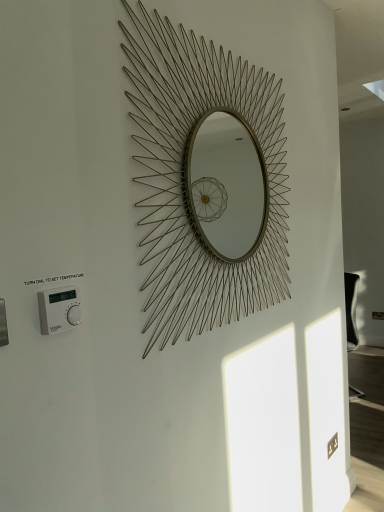
Question: Is white plastic thermostat at lower left smaller than gold wire mirror at center?

Choices:
 (A) no
 (B) yes

Answer: (B)

Question: Is white plastic thermostat at lower left placed right next to gold wire mirror at center?

Choices:
 (A) yes
 (B) no

Answer: (B)

Question: From the image's perspective, is white plastic thermostat at lower left on top of gold wire mirror at center?

Choices:
 (A) no
 (B) yes

Answer: (A)

Question: Is white plastic thermostat at lower left located outside gold wire mirror at center?

Choices:
 (A) no
 (B) yes

Answer: (B)

Question: Can you confirm if white plastic thermostat at lower left is bigger than gold wire mirror at center?

Choices:
 (A) no
 (B) yes

Answer: (A)

Question: Can you confirm if white plastic thermostat at lower left is positioned to the right of gold wire mirror at center?

Choices:
 (A) no
 (B) yes

Answer: (A)

Question: Would you say gold wire mirror at center is outside white plastic thermostat at lower left?

Choices:
 (A) no
 (B) yes

Answer: (B)

Question: Is gold wire mirror at center to the right of white plastic thermostat at lower left from the viewer's perspective?

Choices:
 (A) yes
 (B) no

Answer: (A)

Question: Does gold wire mirror at center have a greater height compared to white plastic thermostat at lower left?

Choices:
 (A) no
 (B) yes

Answer: (B)

Question: Are gold wire mirror at center and white plastic thermostat at lower left far apart?

Choices:
 (A) yes
 (B) no

Answer: (B)

Question: Is gold wire mirror at center wider than white plastic thermostat at lower left?

Choices:
 (A) yes
 (B) no

Answer: (A)

Question: Does gold wire mirror at center contain white plastic thermostat at lower left?

Choices:
 (A) no
 (B) yes

Answer: (A)

Question: In terms of height, does white plastic thermostat at lower left look taller or shorter compared to gold wire mirror at center?

Choices:
 (A) tall
 (B) short

Answer: (B)